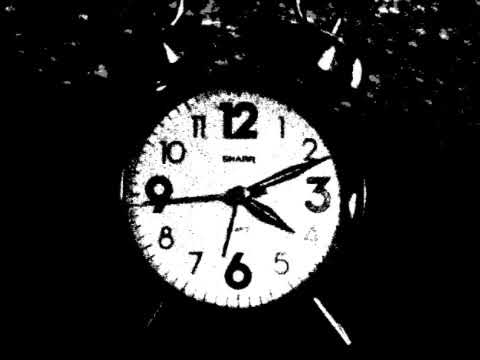
Where is `clock face`? clock face is located at coordinates pyautogui.click(x=212, y=177).